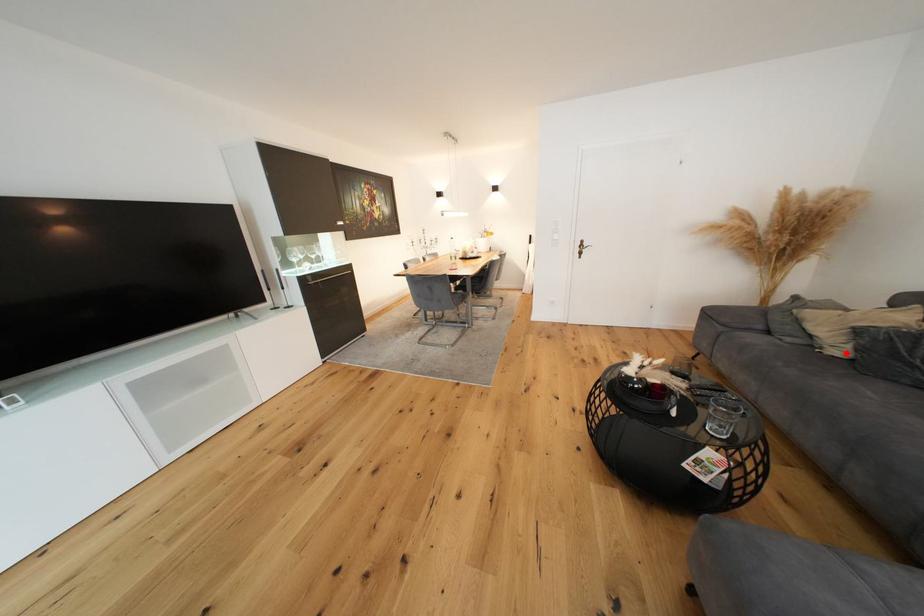
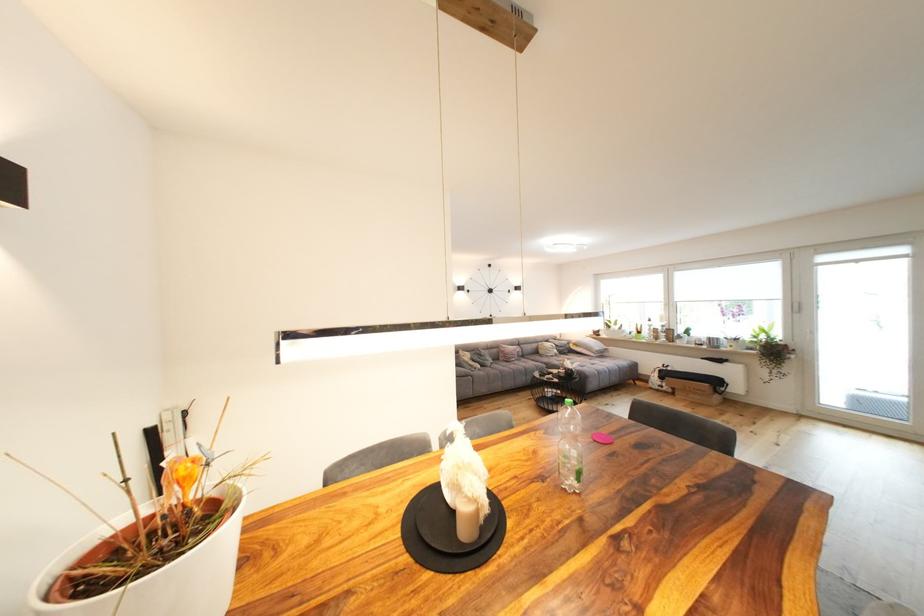
In the second image, find the point that corresponds to the highlighted location in the first image.

(485, 368)